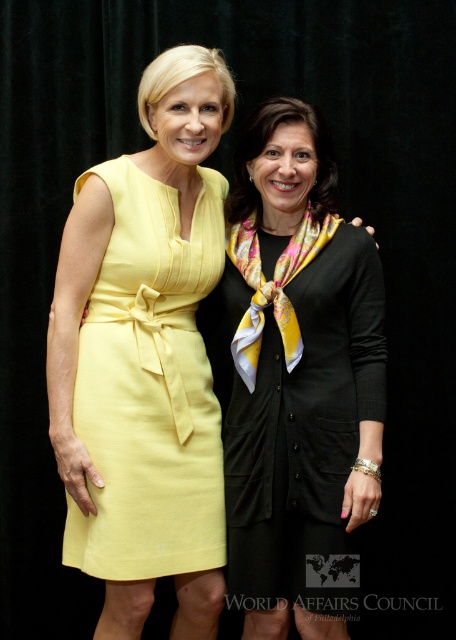
Question: Can you confirm if black silk dress at center is positioned to the left of linen yellow dress at left?

Choices:
 (A) yes
 (B) no

Answer: (B)

Question: Can you confirm if black silk dress at center is thinner than linen yellow dress at left?

Choices:
 (A) no
 (B) yes

Answer: (A)

Question: Where is black silk dress at center located in relation to linen yellow dress at left in the image?

Choices:
 (A) below
 (B) above

Answer: (A)